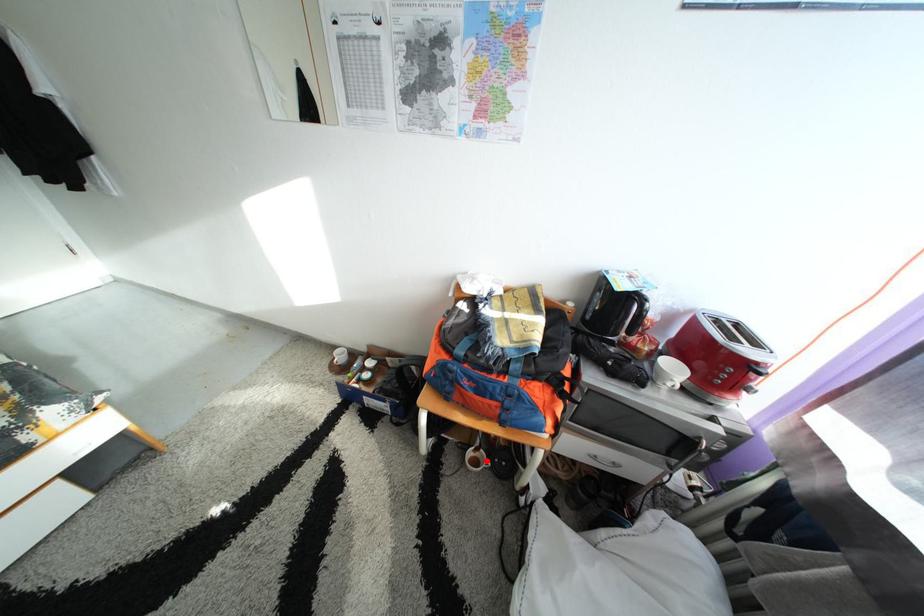
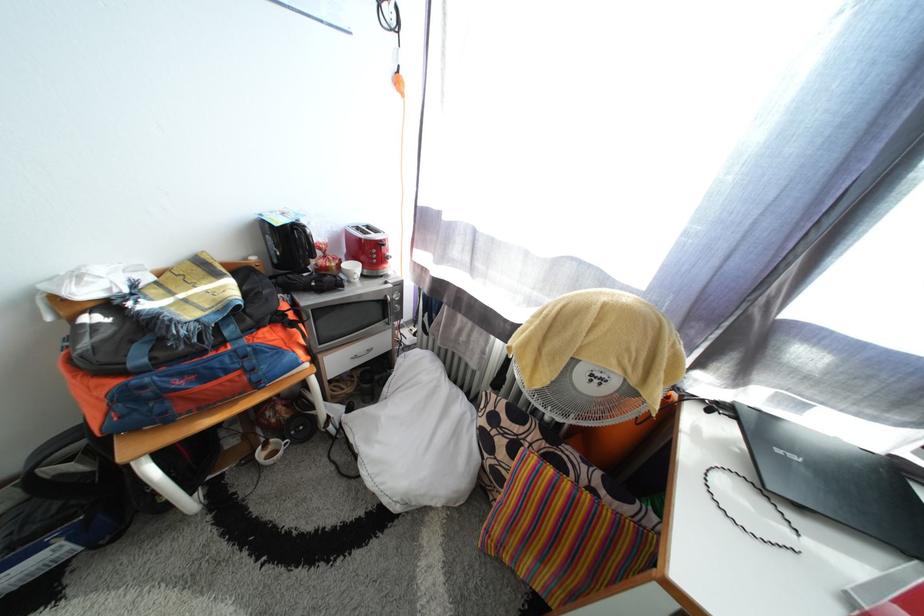
The point at the highlighted location is marked in the first image. Where is the corresponding point in the second image?

(280, 455)